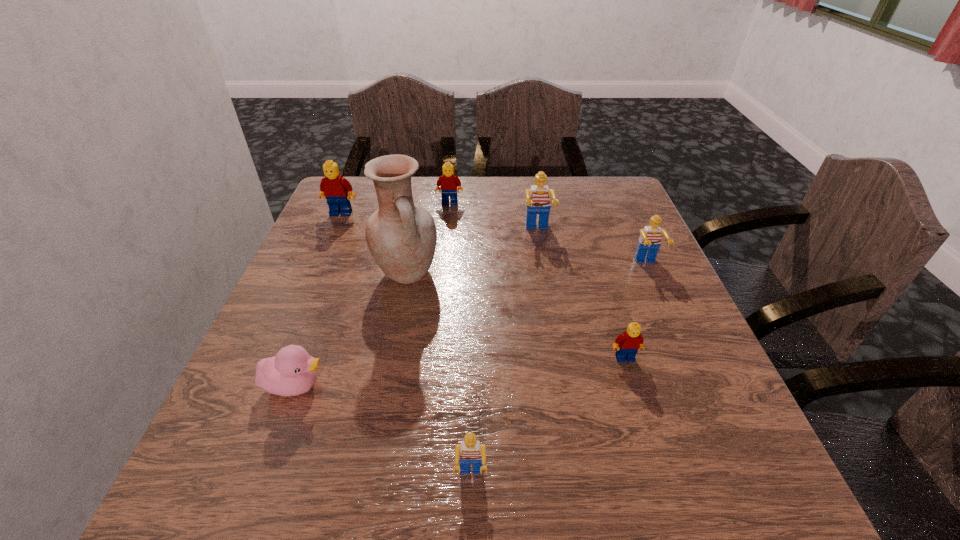
Where is `blank space located 0.150m on the face of the rightmost blue Lego`? The image size is (960, 540). blank space located 0.150m on the face of the rightmost blue Lego is located at coordinates (672, 321).

This screenshot has height=540, width=960. Find the location of `blank space located 0.190m on the front-facing side of the pink duckling`. blank space located 0.190m on the front-facing side of the pink duckling is located at coordinates (438, 386).

The image size is (960, 540). Find the location of `free space located 0.130m on the front-facing side of the fifth farthest Lego`. free space located 0.130m on the front-facing side of the fifth farthest Lego is located at coordinates (646, 427).

Locate an element on the screen. object at the near edge is located at coordinates (470, 451).

The height and width of the screenshot is (540, 960). Identify the location of Lego situated at the left edge. (334, 188).

The width and height of the screenshot is (960, 540). Identify the location of duckling present at the left edge. (292, 371).

At what (x,y) coordinates should I click in order to perform the action: click on object that is positioned at the far left corner. Please return your answer as a coordinate pair (x, y). The height and width of the screenshot is (540, 960). Looking at the image, I should click on (334, 188).

At what (x,y) coordinates should I click in order to perform the action: click on free space at the far edge. Please return your answer as a coordinate pair (x, y). This screenshot has height=540, width=960. Looking at the image, I should click on (506, 221).

This screenshot has height=540, width=960. In order to click on vacant region at the left edge in this screenshot , I will do `click(351, 314)`.

In the image, there is a desktop. Where is `vacant space at the far left corner`? The height and width of the screenshot is (540, 960). vacant space at the far left corner is located at coordinates pos(355,218).